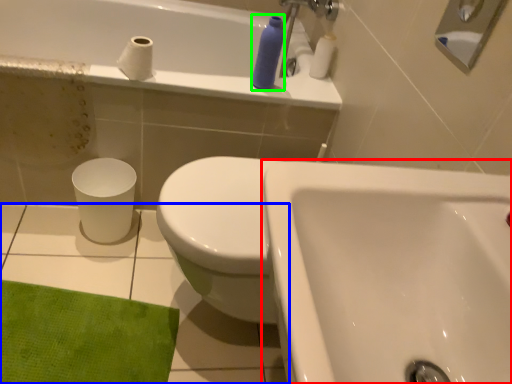
Question: Which object is positioned farthest from sink (highlighted by a red box)? Select from ceramic tile (highlighted by a blue box) and toiletry (highlighted by a green box).

Choices:
 (A) ceramic tile
 (B) toiletry

Answer: (B)